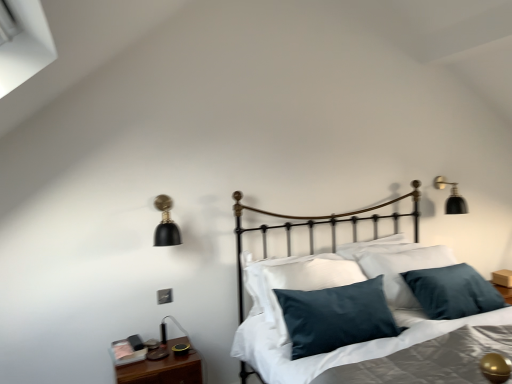
Question: Considering the positions of silky gray sheet at center and wooden nightstand at lower left in the image, is silky gray sheet at center taller or shorter than wooden nightstand at lower left?

Choices:
 (A) short
 (B) tall

Answer: (B)

Question: From the image's perspective, is silky gray sheet at center positioned above or below wooden nightstand at lower left?

Choices:
 (A) above
 (B) below

Answer: (A)

Question: Considering the real-world distances, which object is farthest from the silky gray sheet at center?

Choices:
 (A) black matte wall sconce at upper right, which is counted as the 2th lamp, starting from the front
 (B) velvet dark blue pillow at center, which is the 2th pillow in back-to-front order
 (C) wooden nightstand at lower left
 (D) velvety dark blue pillow at center, which appears as the first pillow when viewed from the back
 (E) black matte lamp at left, the first lamp in the left-to-right sequence

Answer: (A)

Question: Estimate the real-world distances between objects in this image. Which object is farther from the velvet dark blue pillow at center, which is the 2th pillow in back-to-front order?

Choices:
 (A) silky gray sheet at center
 (B) black matte wall sconce at upper right, which ranks as the 1th lamp in back-to-front order
 (C) wooden nightstand at lower left
 (D) velvety dark blue pillow at center, which ranks as the second pillow in front-to-back order
 (E) black matte lamp at left, placed as the second lamp when sorted from right to left

Answer: (B)